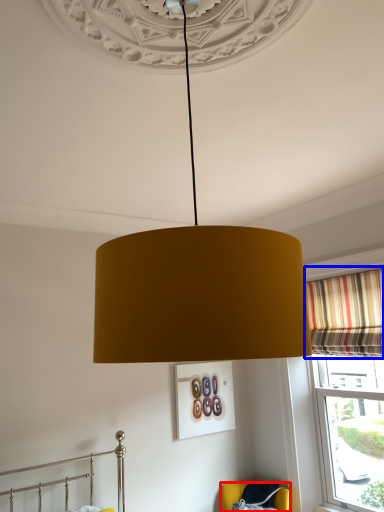
Question: Which of the following is the farthest to the observer, furniture (highlighted by a red box) or curtain (highlighted by a blue box)?

Choices:
 (A) furniture
 (B) curtain

Answer: (A)